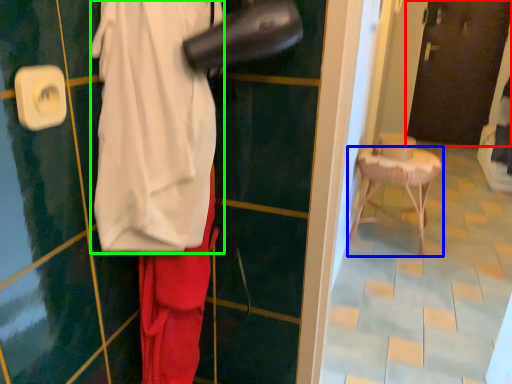
Question: Based on their relative distances, which object is nearer to door (highlighted by a red box)? Choose from furniture (highlighted by a blue box) and wide (highlighted by a green box).

Choices:
 (A) furniture
 (B) wide

Answer: (A)